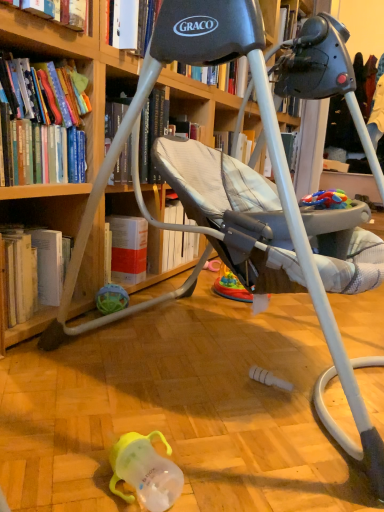
At what (x,y) coordinates should I click in order to perform the action: click on vacant region in front of translucent rubber ball at lower left, the 2th toy when ordered from top to bottom. Please return your answer as a coordinate pair (x, y). This screenshot has height=512, width=384. Looking at the image, I should click on (110, 335).